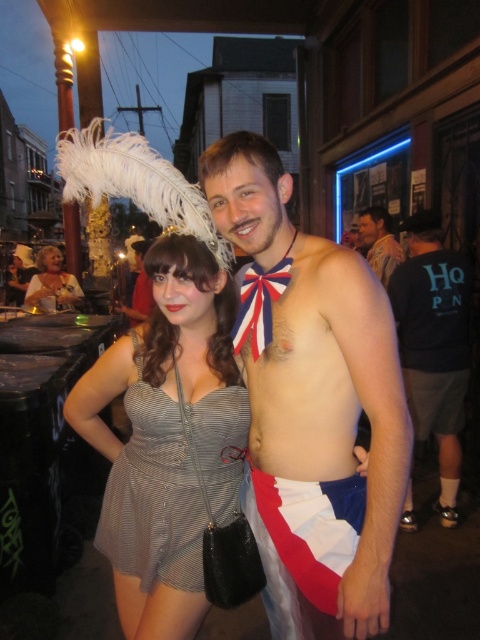
You are a photographer trying to capture a photo of the white cotton flag at lower center and the matte silver dress at center. You need to ensure both are in focus. Given that your camera can focus on objects within a 5 meter range, will both objects be in focus?

The white cotton flag at lower center is 4.89 meters from the matte silver dress at center. Since the distance between them is within the 5 meter range, both objects will be in focus.

You are standing in the middle of the street and want to take a photo of both the point at (394, 307) and the point at (60, 262). Which point will appear larger in your camera view?

Point at (394, 307) will appear larger because it is closer to the camera than point at (60, 262).